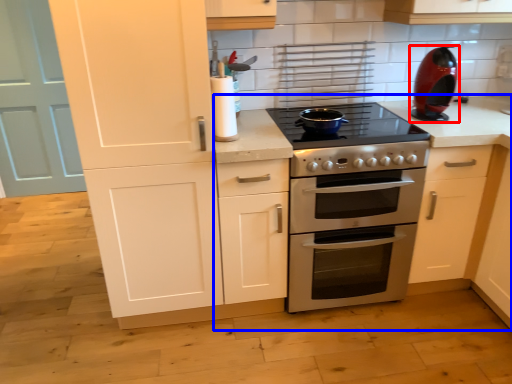
Question: Which object appears closest to the camera in this image, kitchen appliance (highlighted by a red box) or countertop (highlighted by a blue box)?

Choices:
 (A) kitchen appliance
 (B) countertop

Answer: (B)